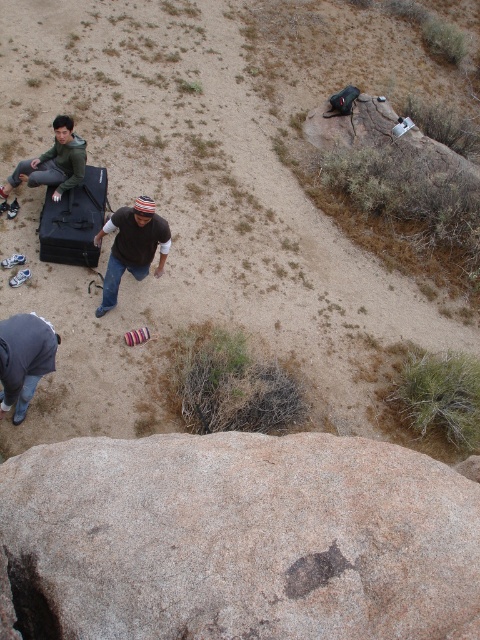
Question: Which point is closer to the camera?

Choices:
 (A) (64, 172)
 (B) (26, 224)
 (C) (34, 358)

Answer: (C)

Question: Does brown cotton shirt at center have a smaller size compared to gray fabric squat at lower left?

Choices:
 (A) no
 (B) yes

Answer: (A)

Question: Considering the real-world distances, which object is closest to the brown rough rock at bottom?

Choices:
 (A) brown cotton shirt at center
 (B) gray fabric squat at lower left

Answer: (B)

Question: Is brown rock at center behind gray fabric squat at lower left?

Choices:
 (A) yes
 (B) no

Answer: (A)

Question: Estimate the real-world distances between objects in this image. Which object is farther from the brown rough rock at bottom?

Choices:
 (A) gray fabric squat at lower left
 (B) matte green jacket at upper left
 (C) brown cotton shirt at center
 (D) brown rock at center

Answer: (B)

Question: Can you confirm if gray fabric squat at lower left is positioned above matte green jacket at upper left?

Choices:
 (A) no
 (B) yes

Answer: (A)